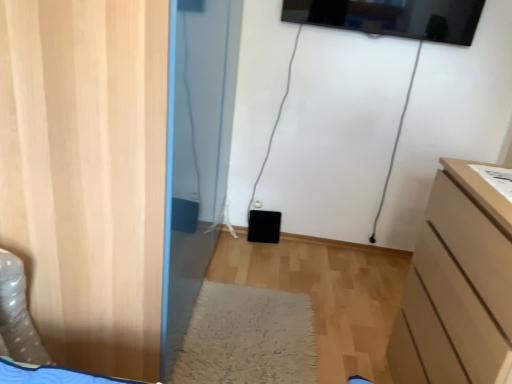
Question: Is white shaggy rug at center shorter than wooden door at left?

Choices:
 (A) no
 (B) yes

Answer: (B)

Question: Does white shaggy rug at center contain wooden door at left?

Choices:
 (A) no
 (B) yes

Answer: (A)

Question: Considering the relative sizes of white shaggy rug at center and wooden door at left in the image provided, is white shaggy rug at center bigger than wooden door at left?

Choices:
 (A) yes
 (B) no

Answer: (B)

Question: From a real-world perspective, is white shaggy rug at center positioned over wooden door at left based on gravity?

Choices:
 (A) no
 (B) yes

Answer: (A)

Question: Is white shaggy rug at center taller than wooden door at left?

Choices:
 (A) no
 (B) yes

Answer: (A)

Question: In the image, is wooden door at left positioned in front of or behind white shaggy rug at center?

Choices:
 (A) front
 (B) behind

Answer: (A)

Question: Is wooden door at left to the left or to the right of white shaggy rug at center in the image?

Choices:
 (A) left
 (B) right

Answer: (A)

Question: From the image's perspective, is wooden door at left located above or below white shaggy rug at center?

Choices:
 (A) above
 (B) below

Answer: (A)

Question: Looking at the image, does wooden door at left seem bigger or smaller compared to white shaggy rug at center?

Choices:
 (A) big
 (B) small

Answer: (A)

Question: In the image, is matte beige chest of drawers at right on the left side or the right side of white shaggy rug at center?

Choices:
 (A) right
 (B) left

Answer: (A)

Question: In terms of height, does matte beige chest of drawers at right look taller or shorter compared to white shaggy rug at center?

Choices:
 (A) tall
 (B) short

Answer: (A)

Question: From the image's perspective, relative to white shaggy rug at center, is matte beige chest of drawers at right above or below?

Choices:
 (A) below
 (B) above

Answer: (B)

Question: Relative to white shaggy rug at center, is matte beige chest of drawers at right in front or behind?

Choices:
 (A) front
 (B) behind

Answer: (A)

Question: From a real-world perspective, is matte beige chest of drawers at right physically located above or below wooden door at left?

Choices:
 (A) above
 (B) below

Answer: (B)

Question: Is point (x=504, y=233) positioned closer to the camera than point (x=25, y=29)?

Choices:
 (A) closer
 (B) farther

Answer: (B)